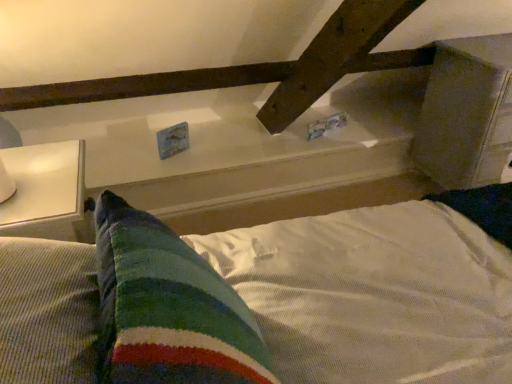
You are a GUI agent. You are given a task and a screenshot of the screen. Output one action in this format:
    pyautogui.click(x=<x>, y=<y>)
    Task: Click on the white textured mattress at lower left
    
    Given the screenshot: What is the action you would take?
    374,295

In order to face white textured mattress at lower left, should I rotate leftwards or rightwards?

It's best to rotate left around 7.166 degrees.

What do you see at coordinates (374, 295) in the screenshot? Image resolution: width=512 pixels, height=384 pixels. I see `white textured mattress at lower left` at bounding box center [374, 295].

Measure the distance between point [31,263] and camera.

59.70 centimeters.

Where is `white textured mattress at lower left`? This screenshot has width=512, height=384. white textured mattress at lower left is located at coordinates (374, 295).